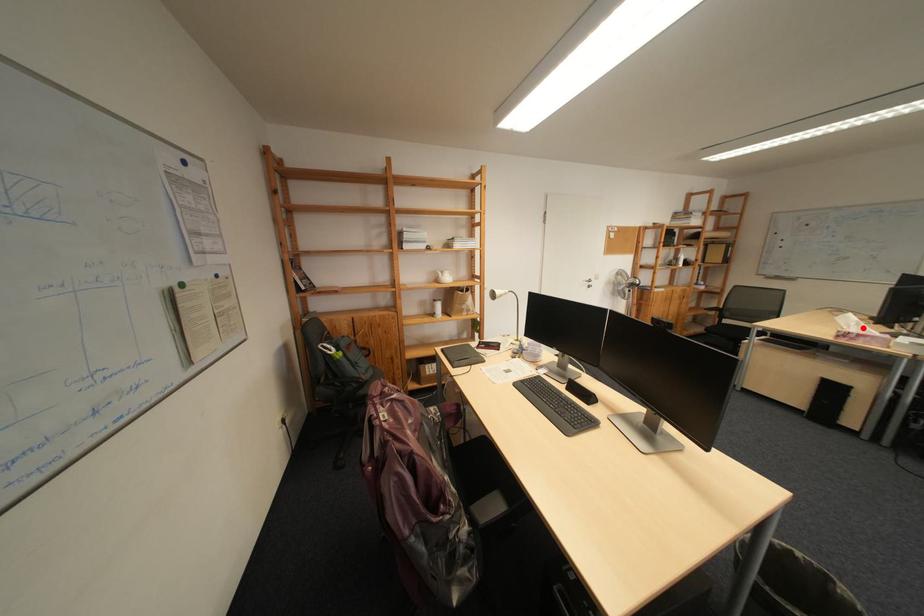
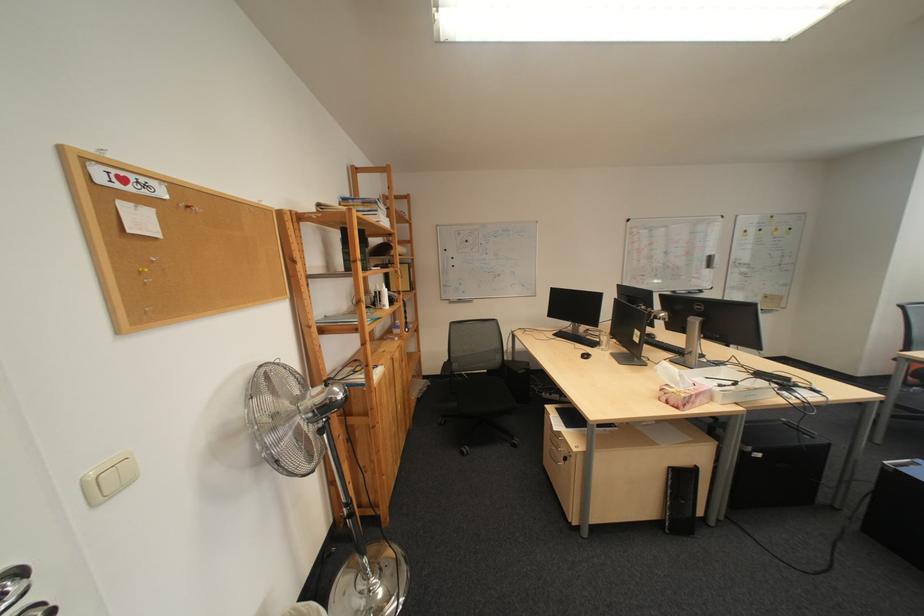
Question: I am providing you with two images of the same scene from different viewpoints. Given a red point in image1, look at the same physical point in image2. Is it:

Choices:
 (A) Closer to the viewpoint
 (B) Farther from the viewpoint

Answer: (B)